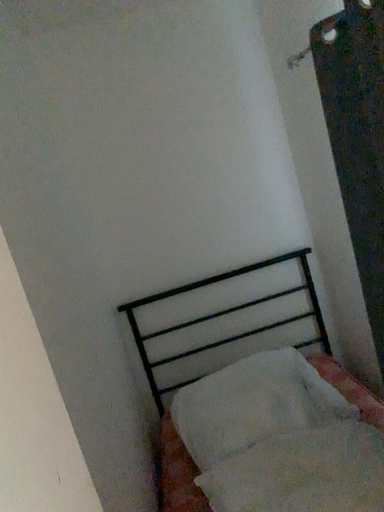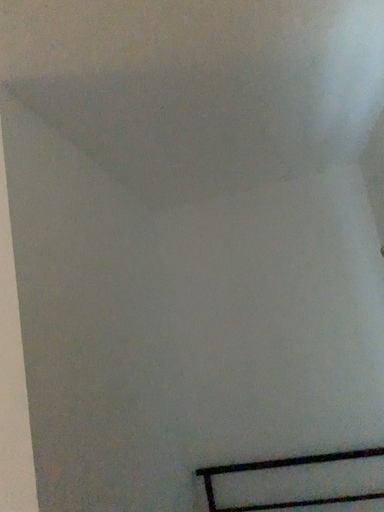
Question: How did the camera likely rotate when shooting the video?

Choices:
 (A) rotated upward
 (B) rotated downward

Answer: (A)